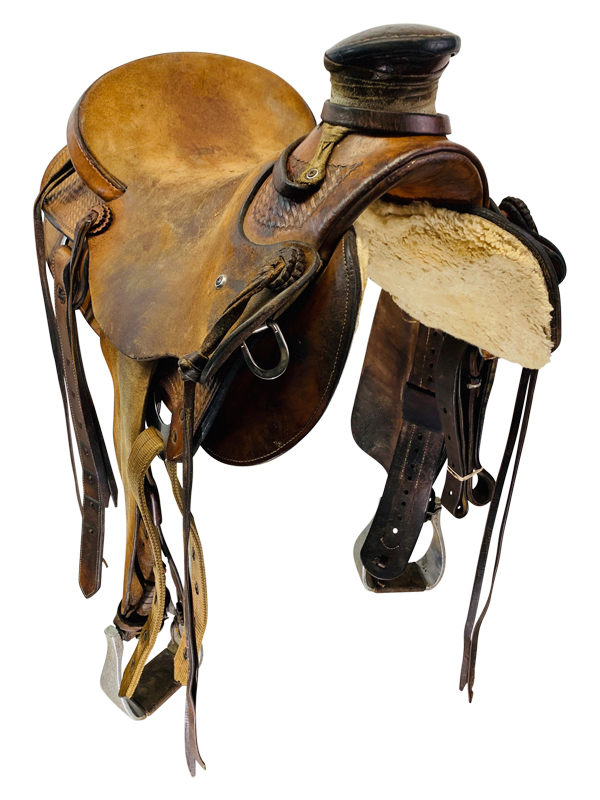
The height and width of the screenshot is (800, 600). Find the location of `fur padding`. fur padding is located at coordinates (477, 278).